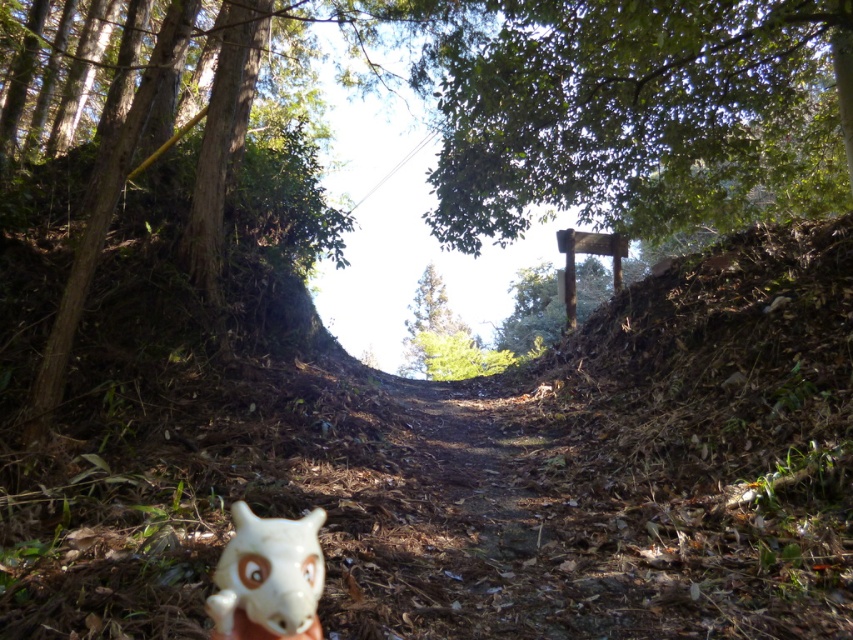
You are a hiker who just found the white matte plush toy at lower left and the green matte tree at center on your forest path. Which object is closer to the ground?

The white matte plush toy at lower left is below the green matte tree at center, so it is closer to the ground.

You are a hiker who has just found a white matte plush toy at lower left on a forest path. You want to place it exactly at point (268, 579) so that it can be easily seen by others. Is the current location of the white matte plush toy at lower left already at the desired coordinates?

Yes, the white matte plush toy at lower left is already located at point (268, 579) as specified.